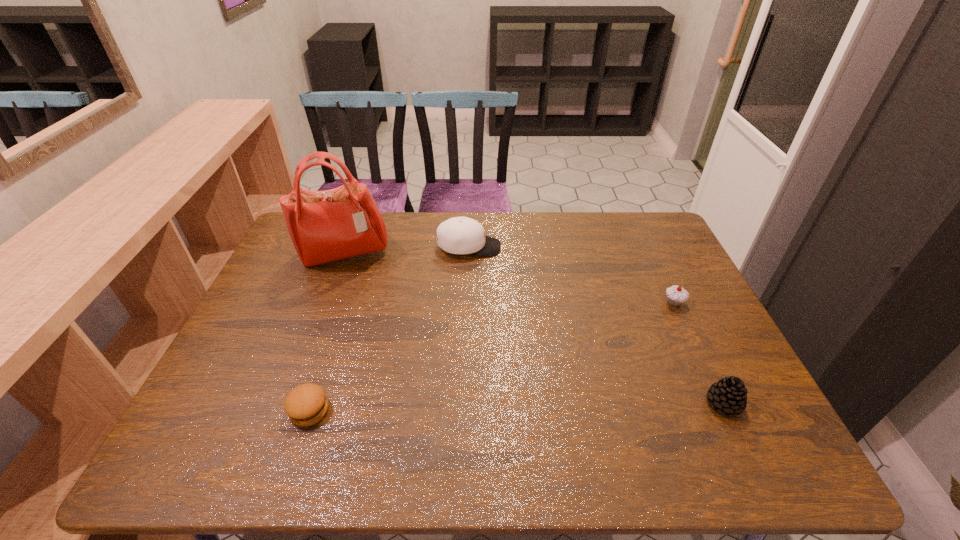
Find the location of a particular element. The width and height of the screenshot is (960, 540). free space between the third nearest object and the baseball cap is located at coordinates (571, 275).

Where is `object that ranks as the second closest to the third nearest object`? The width and height of the screenshot is (960, 540). object that ranks as the second closest to the third nearest object is located at coordinates (459, 235).

Identify the location of object that is the fourth nearest to the tallest object. This screenshot has height=540, width=960. (729, 395).

Find the location of a particular element. free point that satisfies the following two spatial constraints: 1. on the front-facing side of the handbag; 2. on the left side of the cupcake is located at coordinates (326, 302).

At what (x,y) coordinates should I click in order to perform the action: click on free space that satisfies the following two spatial constraints: 1. on the front-facing side of the handbag; 2. on the left side of the cupcake. Please return your answer as a coordinate pair (x, y). This screenshot has height=540, width=960. Looking at the image, I should click on tap(326, 302).

Where is `free spot that satisfies the following two spatial constraints: 1. on the front-facing side of the hamburger; 2. on the left side of the handbag`? free spot that satisfies the following two spatial constraints: 1. on the front-facing side of the hamburger; 2. on the left side of the handbag is located at coordinates (287, 410).